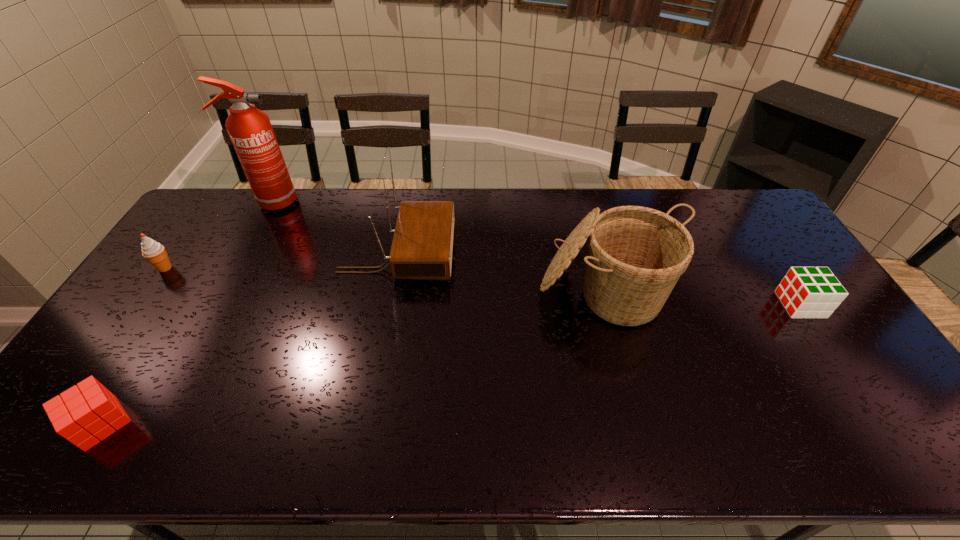
This screenshot has width=960, height=540. In order to click on free space between the leftmost object and the farther cube in this screenshot , I will do `click(483, 286)`.

Choose which object is the third nearest neighbor to the left cube. Please provide its 2D coordinates. Your answer should be formatted as a tuple, i.e. [(x, y)], where the tuple contains the x and y coordinates of a point satisfying the conditions above.

[(250, 130)]

Point out which object is positioned as the fifth nearest to the farther cube. Please provide its 2D coordinates. Your answer should be formatted as a tuple, i.e. [(x, y)], where the tuple contains the x and y coordinates of a point satisfying the conditions above.

[(154, 252)]

The height and width of the screenshot is (540, 960). Identify the location of vacant point that satisfies the following two spatial constraints: 1. on the front panel of the third object from right to left; 2. on the back side of the basket. (391, 290).

You are a GUI agent. You are given a task and a screenshot of the screen. Output one action in this format:
    pyautogui.click(x=<x>, y=<y>)
    Task: Click on the free space in the image that satisfies the following two spatial constraints: 1. on the front panel of the fourth object from left to right; 2. on the left side of the basket
    The width and height of the screenshot is (960, 540).
    Given the screenshot: What is the action you would take?
    pyautogui.click(x=391, y=290)

Locate an element on the screen. The image size is (960, 540). vacant space that satisfies the following two spatial constraints: 1. at the nozzle of the fifth object from left to right; 2. on the left side of the tallest object is located at coordinates (223, 290).

At what (x,y) coordinates should I click in order to perform the action: click on blank space that satisfies the following two spatial constraints: 1. on the back side of the nearer cube; 2. on the right side of the fifth object from left to right. Please return your answer as a coordinate pair (x, y). This screenshot has width=960, height=540. Looking at the image, I should click on (185, 290).

The image size is (960, 540). I want to click on free location that satisfies the following two spatial constraints: 1. on the back side of the nearer cube; 2. on the left side of the basket, so pos(185,290).

Where is `vacant space that satisfies the following two spatial constraints: 1. on the back side of the fifth object from left to right; 2. on the front panel of the third object from right to left`? The image size is (960, 540). vacant space that satisfies the following two spatial constraints: 1. on the back side of the fifth object from left to right; 2. on the front panel of the third object from right to left is located at coordinates [596, 253].

This screenshot has width=960, height=540. I want to click on vacant position in the image that satisfies the following two spatial constraints: 1. on the front panel of the radio_receiver; 2. on the left side of the basket, so click(391, 290).